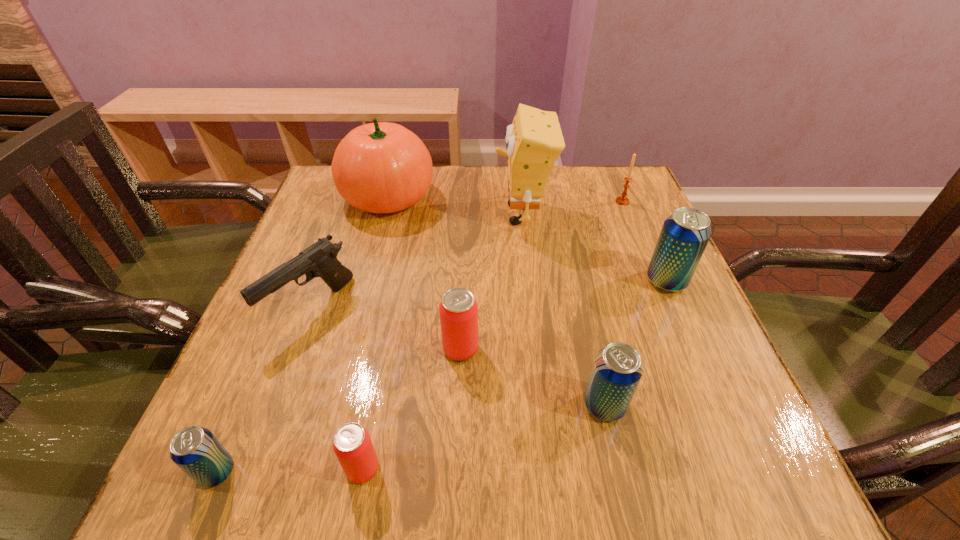
I want to click on yellow sponge, so click(x=534, y=141).

Locate an element on the screen. Image resolution: width=960 pixels, height=540 pixels. pumpkin is located at coordinates (381, 167).

Identify the location of the tallest beer can. (685, 234).

Where is `the third tallest object`? This screenshot has height=540, width=960. the third tallest object is located at coordinates (685, 234).

I want to click on candle_holder, so click(x=622, y=200).

Where is `black gun`? This screenshot has width=960, height=540. black gun is located at coordinates (320, 259).

At what (x,y) coordinates should I click in order to perform the action: click on the right red beer can. Please return your answer as a coordinate pair (x, y). This screenshot has width=960, height=540. Looking at the image, I should click on (458, 310).

Where is `the bigger red beer can`? The width and height of the screenshot is (960, 540). the bigger red beer can is located at coordinates (458, 310).

What are the coordinates of `the second blue beer can from left to right` in the screenshot? It's located at (617, 369).

You are a GUI agent. You are given a task and a screenshot of the screen. Output one action in this format:
    pyautogui.click(x=<x>, y=<y>)
    Task: Click on the third nearest beer can
    The width and height of the screenshot is (960, 540).
    Given the screenshot: What is the action you would take?
    pyautogui.click(x=617, y=369)